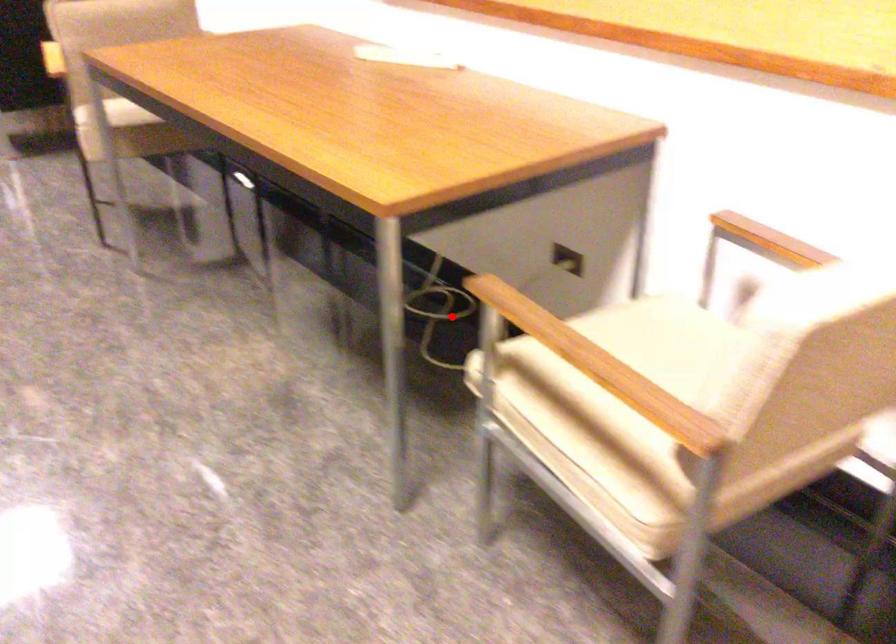
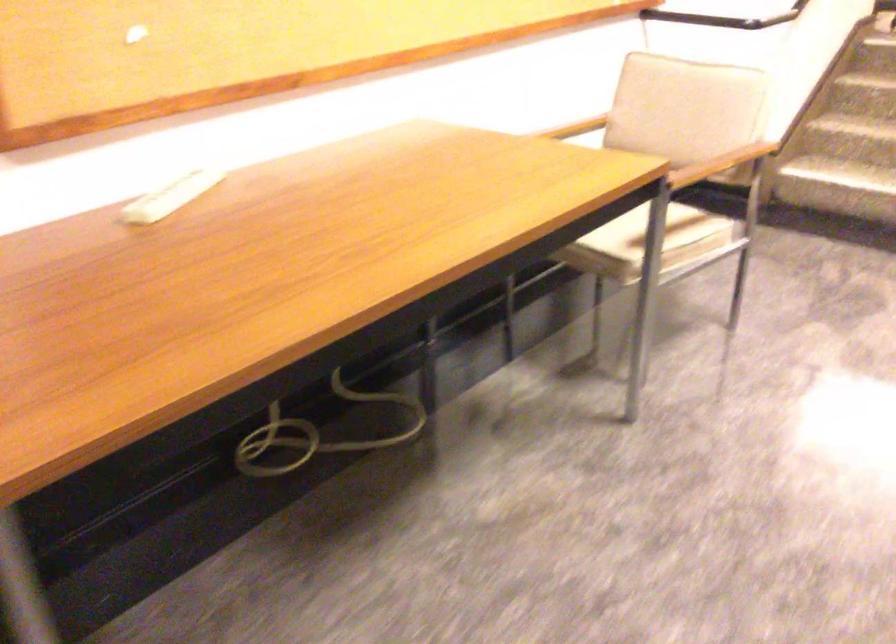
Question: I am providing you with two images of the same scene from different viewpoints. A red point is shown in image1. For the corresponding object point in image2, is it positioned nearer or farther from the camera?

Choices:
 (A) Nearer
 (B) Farther

Answer: (A)